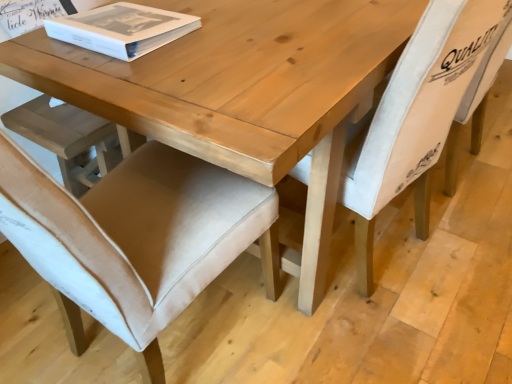
Question: Is light beige fabric chair at center, the first chair in the right-to-left sequence, taller or shorter than white paper book at upper left?

Choices:
 (A) short
 (B) tall

Answer: (B)

Question: Considering the positions of light beige fabric chair at center, the first chair in the right-to-left sequence, and white paper book at upper left in the image, is light beige fabric chair at center, the first chair in the right-to-left sequence, bigger or smaller than white paper book at upper left?

Choices:
 (A) big
 (B) small

Answer: (A)

Question: Considering the real-world distances, which object is farthest from the beige fabric chair at lower left, marked as the 1th chair in a left-to-right arrangement?

Choices:
 (A) light beige fabric chair at center, which is the second chair from left to right
 (B) white paper book at upper left

Answer: (A)

Question: Which is farther from the beige fabric chair at lower left, marked as the 1th chair in a left-to-right arrangement?

Choices:
 (A) white paper book at upper left
 (B) light beige fabric chair at center, which is the second chair from left to right

Answer: (B)